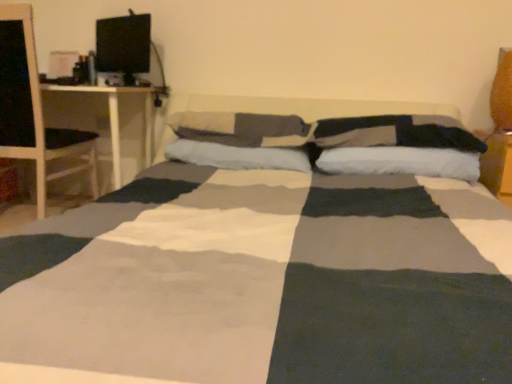
Question: Should I look upward or downward to see white wood desk at left?

Choices:
 (A) up
 (B) down

Answer: (A)

Question: Is soft cotton pillow at center, the 1th pillow from the left, thinner than white wood desk at left?

Choices:
 (A) no
 (B) yes

Answer: (B)

Question: From the image's perspective, would you say soft cotton pillow at center, the 1th pillow from the left, is shown under white wood desk at left?

Choices:
 (A) yes
 (B) no

Answer: (A)

Question: From a real-world perspective, does soft cotton pillow at center, which is the fifth pillow in right-to-left order, sit lower than white wood desk at left?

Choices:
 (A) no
 (B) yes

Answer: (A)

Question: Considering the relative positions of soft cotton pillow at center, the 1th pillow from the left, and white wood desk at left in the image provided, is soft cotton pillow at center, the 1th pillow from the left, to the right of white wood desk at left from the viewer's perspective?

Choices:
 (A) no
 (B) yes

Answer: (B)

Question: Is soft cotton pillow at center, the 1th pillow from the left, at the left side of white wood desk at left?

Choices:
 (A) yes
 (B) no

Answer: (B)

Question: Would you say soft cotton pillow at center, the 1th pillow from the left, contains white wood desk at left?

Choices:
 (A) yes
 (B) no

Answer: (B)

Question: Is soft cotton pillow at center, the 1th pillow from the left, shorter than black glossy computer monitor at upper left?

Choices:
 (A) no
 (B) yes

Answer: (B)

Question: Can you confirm if soft cotton pillow at center, which is the fifth pillow in right-to-left order, is bigger than black glossy computer monitor at upper left?

Choices:
 (A) yes
 (B) no

Answer: (A)

Question: Is soft cotton pillow at center, which is the fifth pillow in right-to-left order, taller than black glossy computer monitor at upper left?

Choices:
 (A) no
 (B) yes

Answer: (A)

Question: Would you say soft cotton pillow at center, the 1th pillow from the left, is outside black glossy computer monitor at upper left?

Choices:
 (A) yes
 (B) no

Answer: (A)

Question: Can you confirm if soft cotton pillow at center, the 1th pillow from the left, is positioned to the right of black glossy computer monitor at upper left?

Choices:
 (A) no
 (B) yes

Answer: (B)

Question: Is soft cotton pillow at center, which is the fifth pillow in right-to-left order, further to the viewer compared to black glossy computer monitor at upper left?

Choices:
 (A) yes
 (B) no

Answer: (B)

Question: From the image's perspective, is white soft pillow at center, acting as the 2th pillow starting from the left, below velvet orange pillow at upper right, the fifth pillow when ordered from left to right?

Choices:
 (A) yes
 (B) no

Answer: (A)